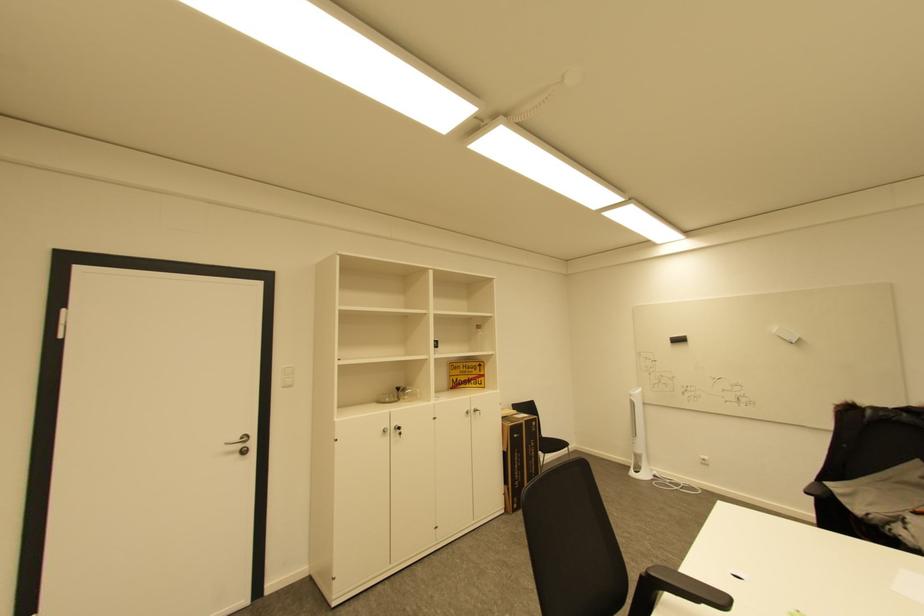
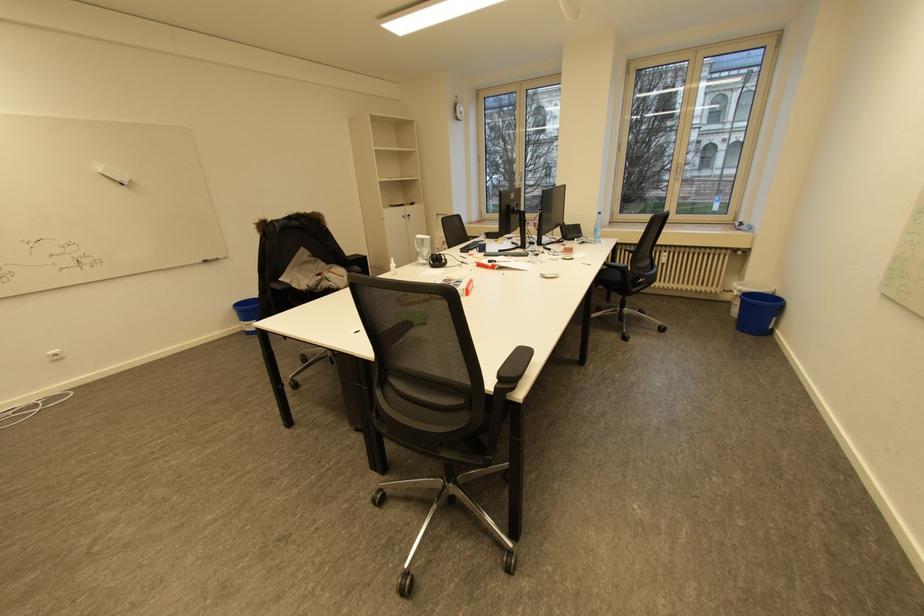
Find the pixel in the second image that matches the point at 796,342 in the first image.

(128, 185)